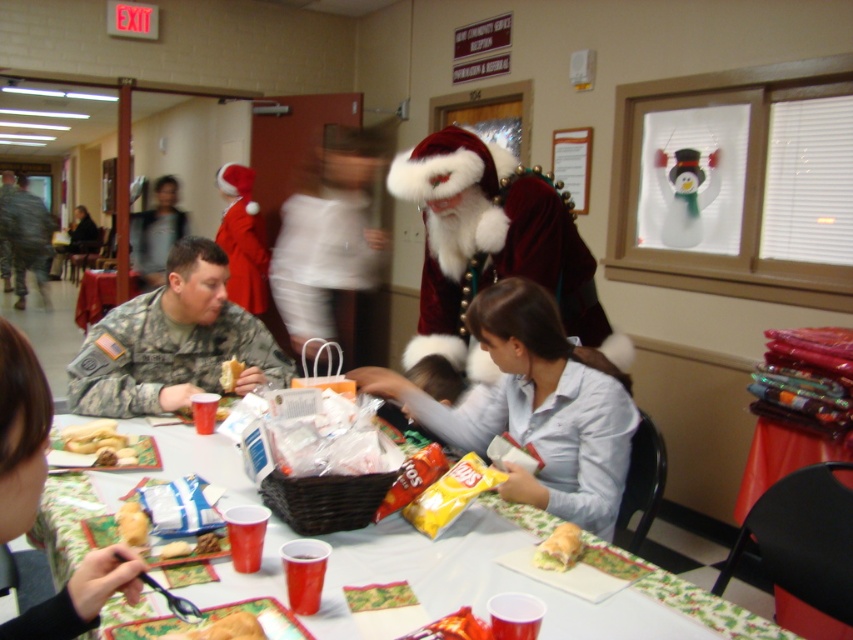
You are planning to place a large holiday decoration in the center of the room where the matte plastic table at center and the velvet santa at center are located. Based on their current positions, which object would you need to move first to create space for the decoration?

The velvet santa at center is to the right of the matte plastic table at center. To place the decoration in the center, you should move the velvet santa at center first since it is already positioned to the right of the table, making it closer to the desired central spot.

You are planning to place a large centerpiece on the matte plastic table at center. Considering the size of the bread matte at center, will the table have enough space for the centerpiece?

The matte plastic table at center is bigger than bread matte at center, so there should be enough space for the centerpiece.